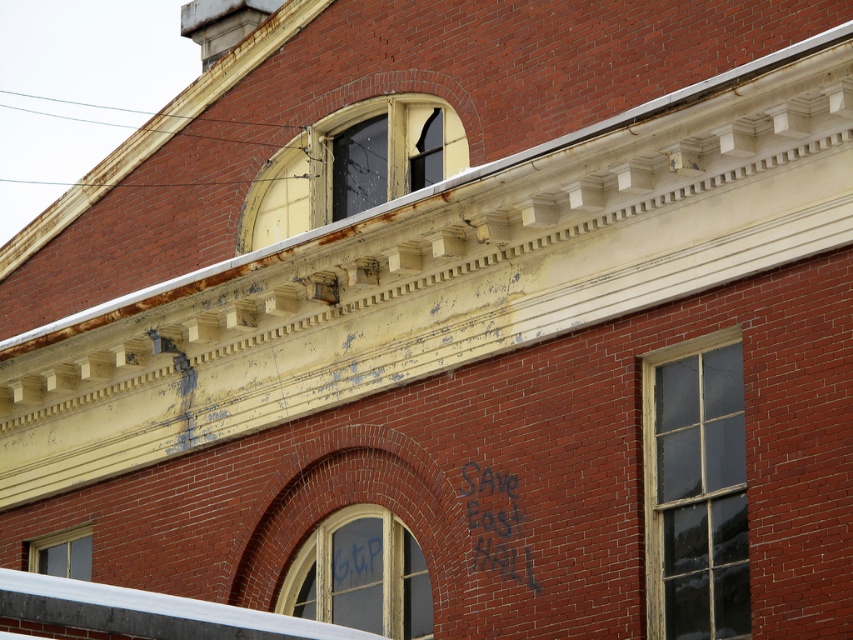
You are standing in front of the red brick building. There is a wooden window at center. Can you tell me what is located at point (695, 490)?

At point (695, 490) lies wooden window at center.

You are an architect inspecting the building. You notice the wooden window at center and the yellow glass window at upper center. Which window has a greater height?

The wooden window at center is taller than the yellow glass window at upper center.